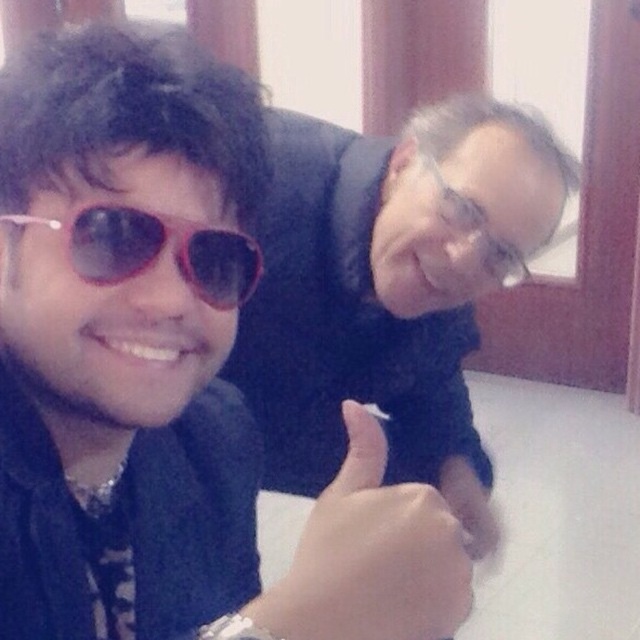
Which of these two, matte black jacket at upper center or pink plastic sunglasses at left, stands taller?

matte black jacket at upper center

How far apart are matte black jacket at upper center and pink plastic sunglasses at left?

11.54 centimeters

You are a GUI agent. You are given a task and a screenshot of the screen. Output one action in this format:
    pyautogui.click(x=<x>, y=<y>)
    Task: Click on the matte black jacket at upper center
    The height and width of the screenshot is (640, 640).
    Given the screenshot: What is the action you would take?
    coord(168,369)

In the scene shown: Who is positioned more to the right, matte black thumb at lower center or pink plastic sunglasses at left?

matte black thumb at lower center is more to the right.

Does point (440, 516) lie in front of point (216, 260)?

Yes, point (440, 516) is in front of point (216, 260).

Measure the distance between point (429, 634) and camera.

Point (429, 634) is 17.58 inches from camera.

Find the location of a particular element. Image resolution: width=640 pixels, height=640 pixels. matte black thumb at lower center is located at coordinates (374, 554).

Who is more distant from viewer, (180, 246) or (502, 262)?

The point (502, 262) is more distant.

Can you confirm if pink plastic sunglasses at left is bigger than matte black glasses at upper center?

Actually, pink plastic sunglasses at left might be smaller than matte black glasses at upper center.

Is point (128, 216) behind point (515, 250)?

No.

You are a GUI agent. You are given a task and a screenshot of the screen. Output one action in this format:
    pyautogui.click(x=<x>, y=<y>)
    Task: Click on the pink plastic sunglasses at left
    
    Given the screenshot: What is the action you would take?
    pyautogui.click(x=156, y=250)